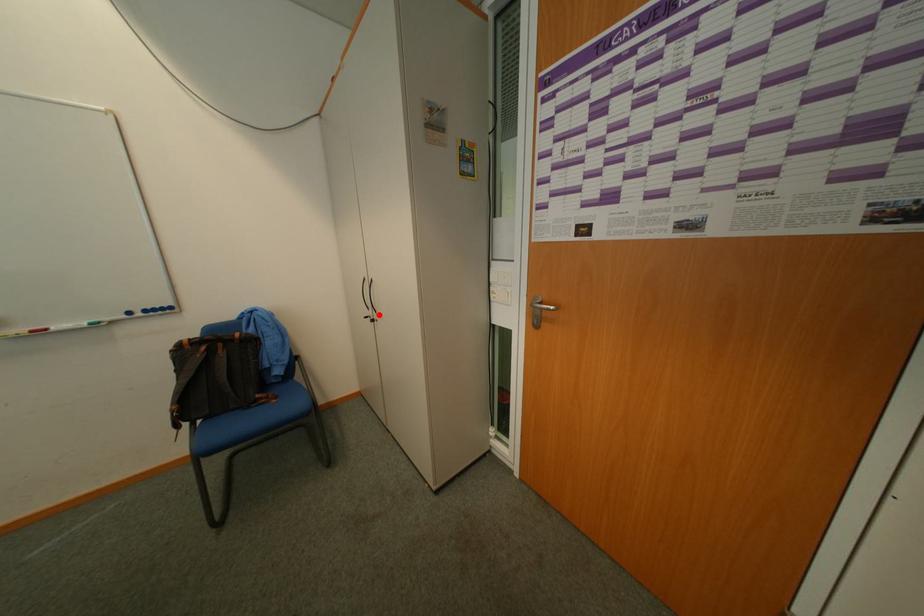
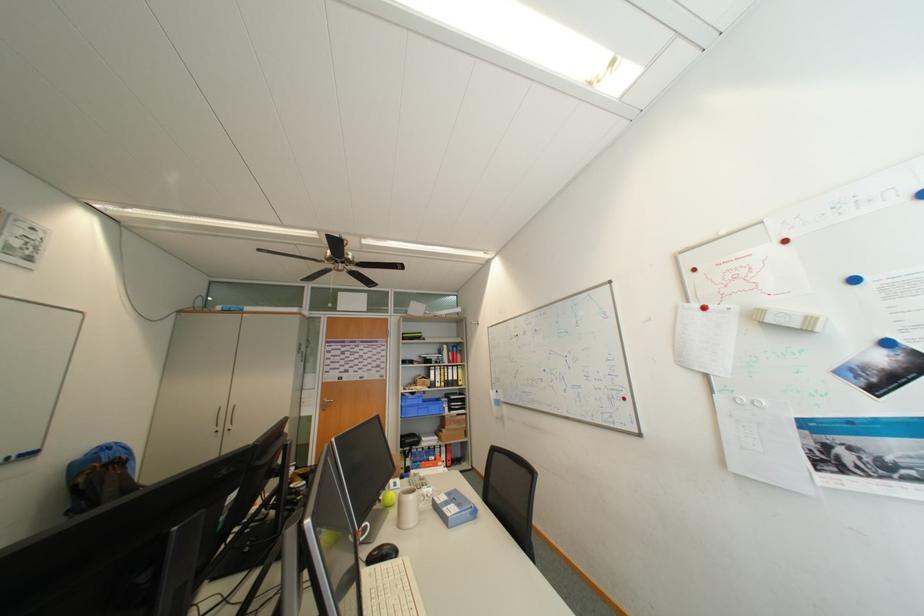
Where in the second image is the point corresponding to the highlighted location from the first image?

(229, 429)